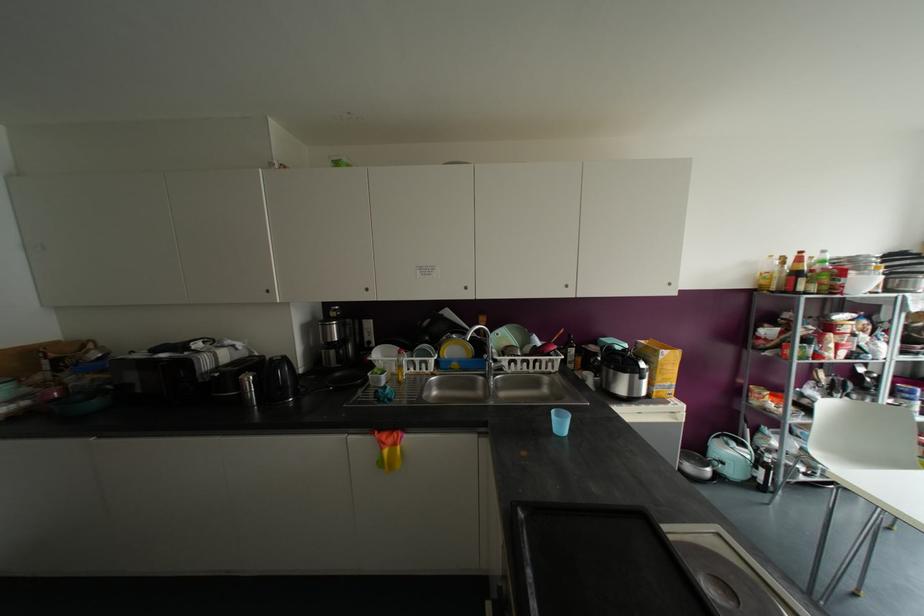
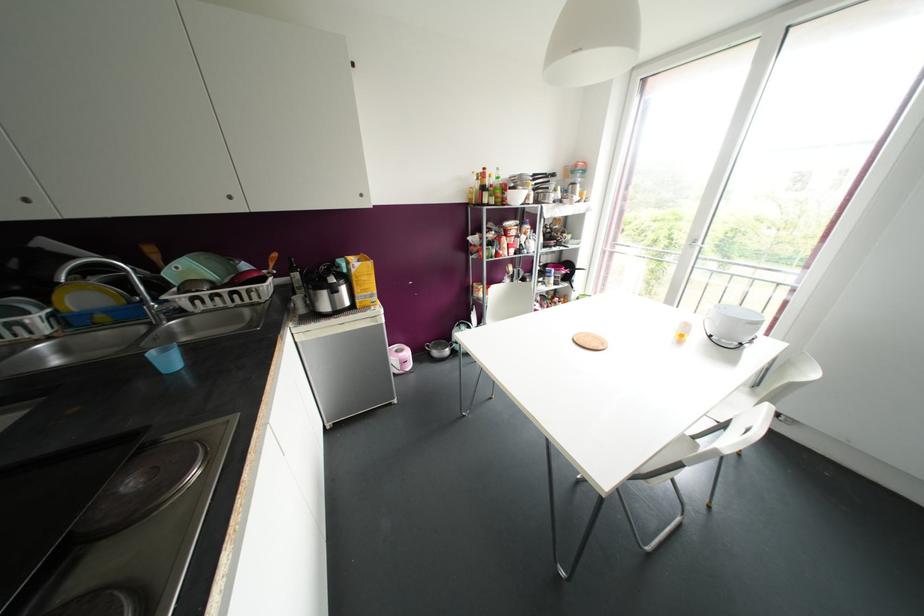
The point at [569,362] is marked in the first image. Where is the corresponding point in the second image?

(298, 286)